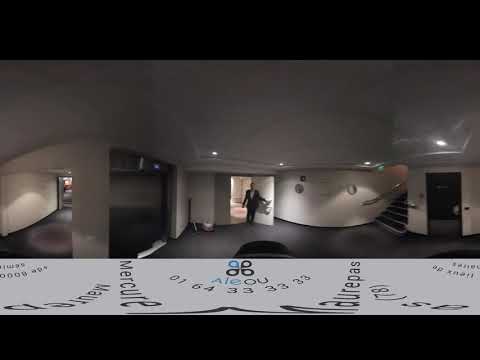
In order to click on staircase in this screenshot , I will do `click(393, 214)`.